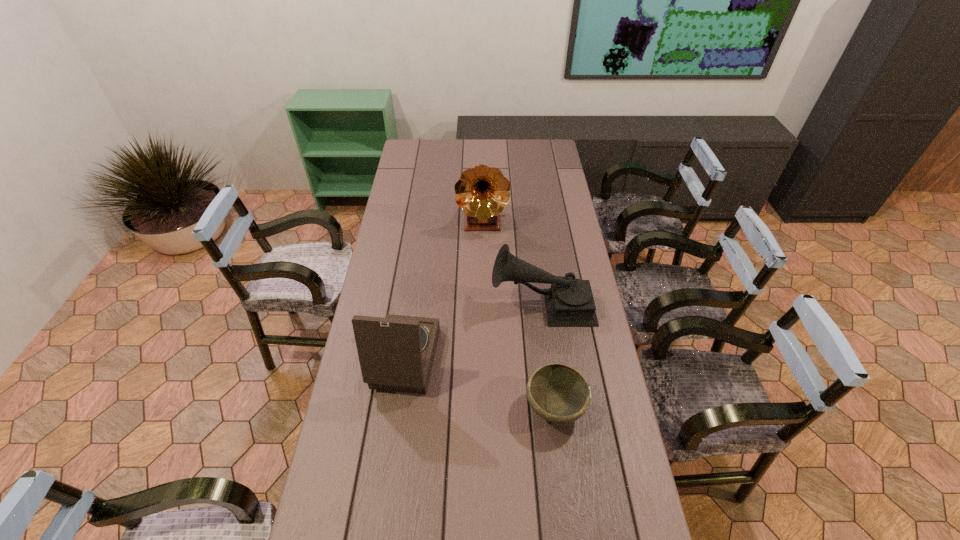
The height and width of the screenshot is (540, 960). Identify the location of blank region between the shortest object and the leftmost object. (476, 384).

At what (x,y) coordinates should I click in order to perform the action: click on free spot between the leftmost phonograph_record and the third tallest object. Please return your answer as a coordinate pair (x, y). Image resolution: width=960 pixels, height=540 pixels. Looking at the image, I should click on [x=469, y=332].

This screenshot has width=960, height=540. What are the coordinates of `free space between the bowl and the leftmost phonograph_record` in the screenshot? It's located at (476, 384).

Locate an element on the screen. object that stands as the third closest to the leftmost object is located at coordinates (482, 192).

Find the location of a particular element. This screenshot has width=960, height=540. object that ranks as the closest to the farthest phonograph_record is located at coordinates (569, 302).

Select which phonograph_record appears as the second closest to the leftmost phonograph_record. Please provide its 2D coordinates. Your answer should be formatted as a tuple, i.e. [(x, y)], where the tuple contains the x and y coordinates of a point satisfying the conditions above.

[(482, 192)]

Identify the location of the closest phonograph_record to the shortest phonograph_record. (396, 353).

At what (x,y) coordinates should I click in order to perform the action: click on free space in the image that satisfies the following two spatial constraints: 1. on the horn of the farthest phonograph_record; 2. on the left side of the shortest object. Please return your answer as a coordinate pair (x, y). The image size is (960, 540). Looking at the image, I should click on (484, 408).

The height and width of the screenshot is (540, 960). I want to click on free region that satisfies the following two spatial constraints: 1. on the front side of the leftmost object; 2. on the left side of the bowl, so point(390,408).

Image resolution: width=960 pixels, height=540 pixels. I want to click on vacant region that satisfies the following two spatial constraints: 1. on the horn of the bowl; 2. on the right side of the farthest object, so tap(484, 408).